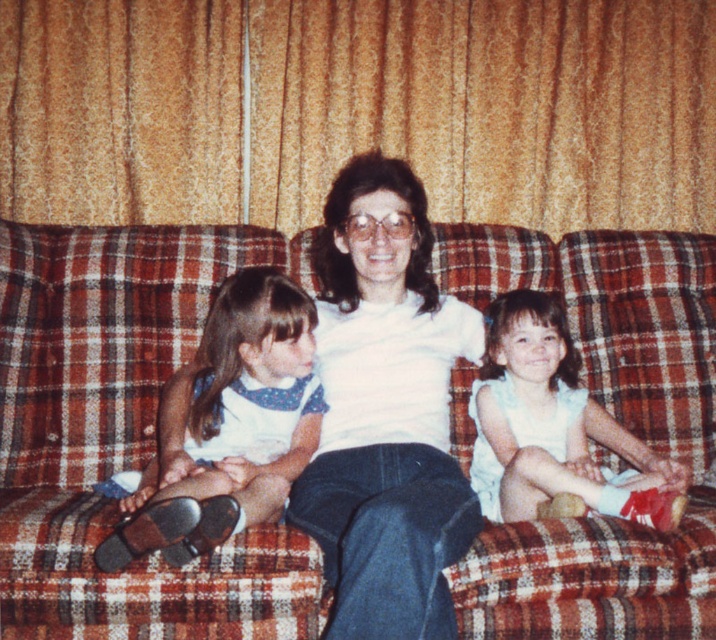
Question: Is white matte shirt at center below white satin dress at center?

Choices:
 (A) yes
 (B) no

Answer: (B)

Question: Is white matte shirt at center bigger than white satin dress at center?

Choices:
 (A) no
 (B) yes

Answer: (B)

Question: Considering the relative positions of brown leather shoes at lower left and white satin dress at center in the image provided, where is brown leather shoes at lower left located with respect to white satin dress at center?

Choices:
 (A) below
 (B) above

Answer: (A)

Question: Estimate the real-world distances between objects in this image. Which object is farther from the plaid fabric couch at center?

Choices:
 (A) brown leather shoes at lower left
 (B) white satin dress at center

Answer: (A)

Question: Which point appears closest to the camera in this image?

Choices:
 (A) (468, 312)
 (B) (200, 497)
 (C) (594, 611)
 (D) (677, 516)

Answer: (B)

Question: Which point appears farthest from the camera in this image?

Choices:
 (A) (551, 307)
 (B) (342, 426)
 (C) (14, 598)
 (D) (203, 451)

Answer: (A)